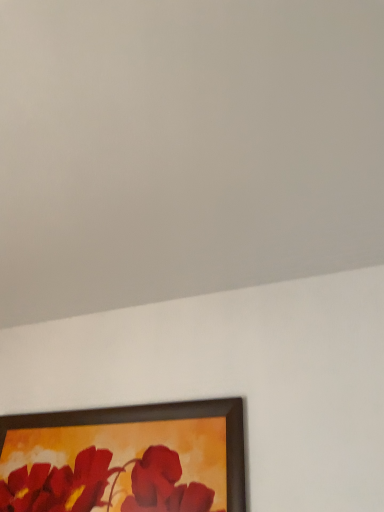
What do you see at coordinates (125, 459) in the screenshot? I see `brown wooden picture frame at lower left` at bounding box center [125, 459].

Where is `brown wooden picture frame at lower left`? brown wooden picture frame at lower left is located at coordinates (125, 459).

What is the approximate width of brown wooden picture frame at lower left?

The width of brown wooden picture frame at lower left is 1.28 inches.

Identify the location of brown wooden picture frame at lower left. The height and width of the screenshot is (512, 384). (125, 459).